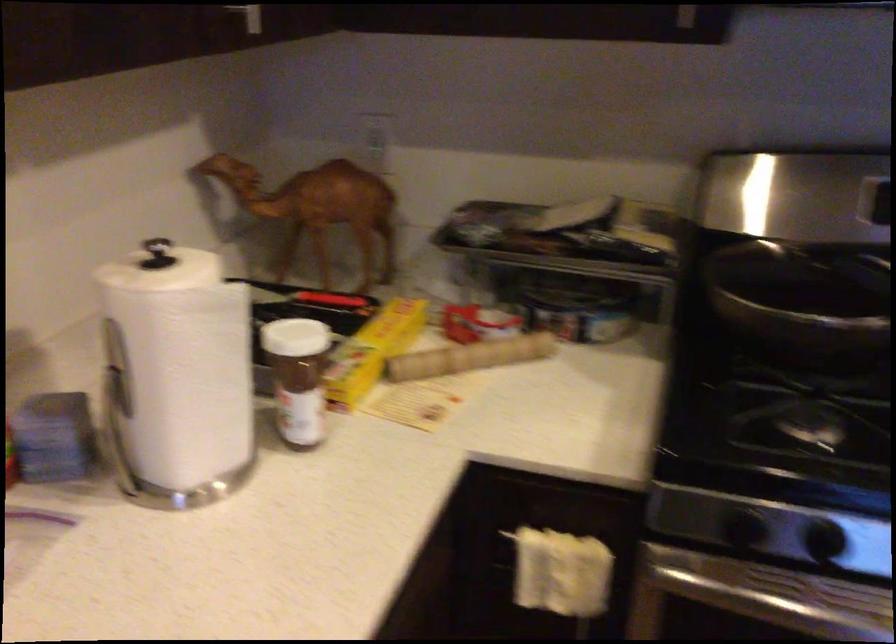
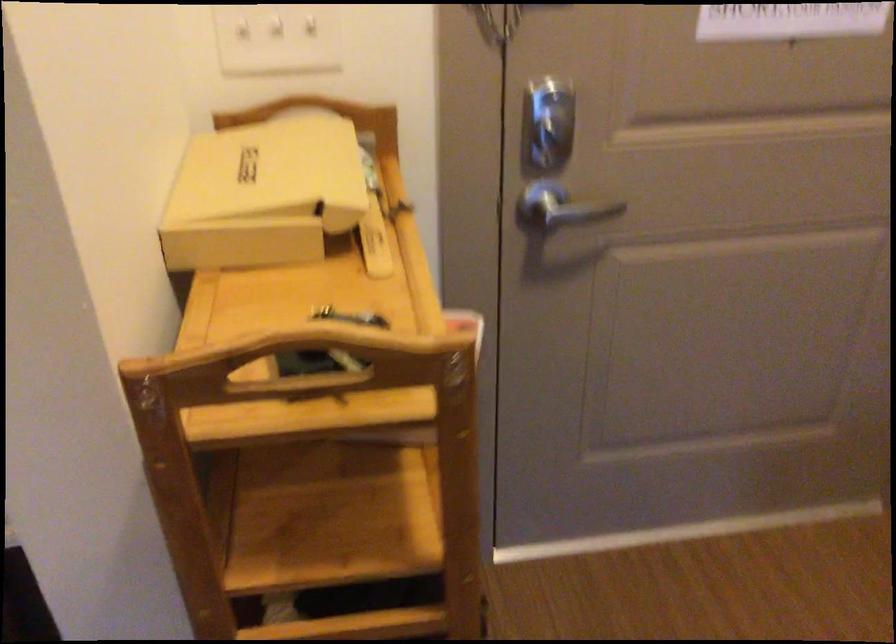
Question: Which direction would the cameraman need to move to produce the second image? Reply with the corresponding letter.

Choices:
 (A) Left
 (B) Right
 (C) Forward
 (D) Backward

Answer: (B)